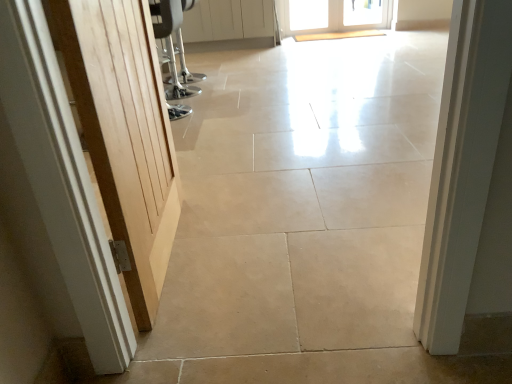
The width and height of the screenshot is (512, 384). What are the coordinates of `vacant space to the right of light wood door at left, which is the 1th door from bottom to top` in the screenshot? It's located at (264, 240).